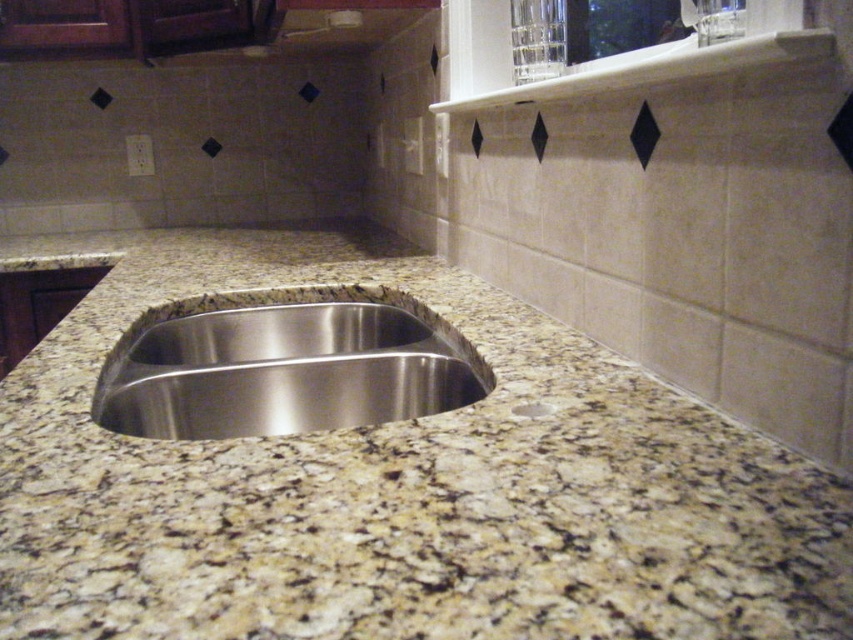
Question: In this image, where is stainless steel sink at center located relative to white marble drain at center?

Choices:
 (A) right
 (B) left

Answer: (B)

Question: Does granite at center appear on the left side of white marble drain at center?

Choices:
 (A) yes
 (B) no

Answer: (A)

Question: Which of the following is the farthest from the observer?

Choices:
 (A) (395, 312)
 (B) (523, 406)
 (C) (293, 588)

Answer: (A)

Question: Considering the real-world distances, which object is farthest from the stainless steel sink at center?

Choices:
 (A) white marble drain at center
 (B) granite at center

Answer: (A)

Question: Which object appears farthest from the camera in this image?

Choices:
 (A) granite at center
 (B) stainless steel sink at center
 (C) white marble drain at center

Answer: (B)

Question: Is granite at center thinner than white marble drain at center?

Choices:
 (A) no
 (B) yes

Answer: (A)